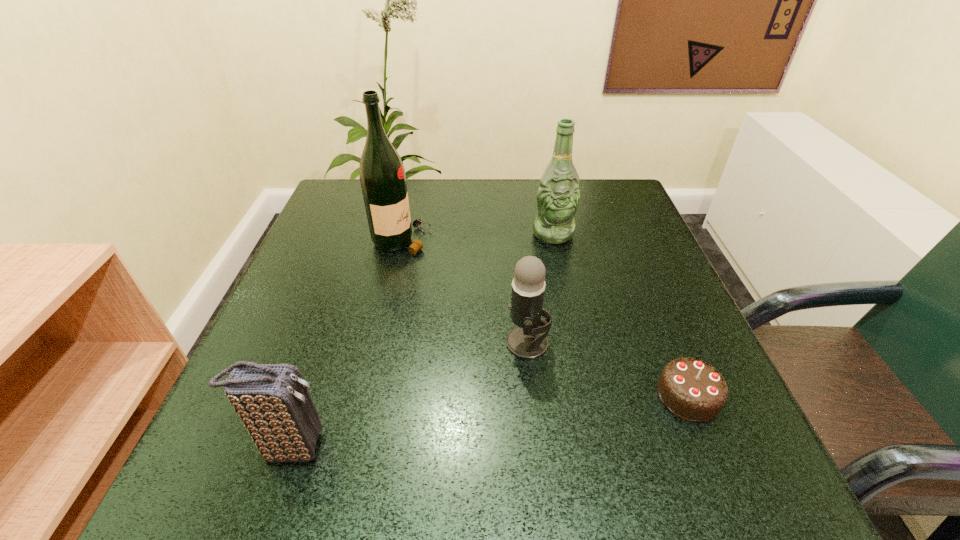
Identify the location of blank space that satisfies the following two spatial constraints: 1. on the back side of the third nearest object; 2. on the surface of the wine bottle. (516, 240).

Locate an element on the screen. This screenshot has width=960, height=540. free region that satisfies the following two spatial constraints: 1. on the surface of the second tallest object; 2. with the zip open on the nearest object is located at coordinates (599, 447).

Locate an element on the screen. This screenshot has height=540, width=960. free space in the image that satisfies the following two spatial constraints: 1. on the surface of the tallest object; 2. on the back side of the fourth farthest object is located at coordinates (367, 396).

Locate an element on the screen. free space that satisfies the following two spatial constraints: 1. on the surface of the second tallest object; 2. on the right side of the rightmost object is located at coordinates (588, 396).

This screenshot has width=960, height=540. In order to click on free location that satisfies the following two spatial constraints: 1. on the front side of the rightmost object; 2. with the zip open on the nearest object in this screenshot , I will do `click(709, 447)`.